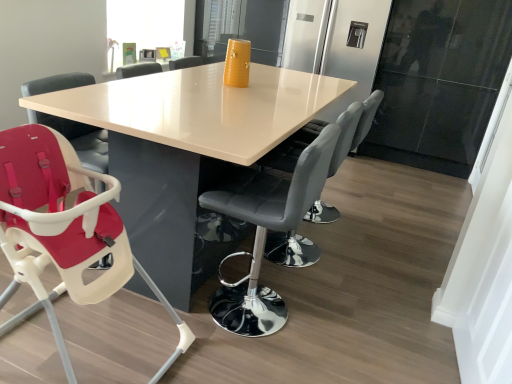
Where is `free space in front of black leather bar stool at center, the 2th chair viewed from the right`? free space in front of black leather bar stool at center, the 2th chair viewed from the right is located at coordinates (247, 359).